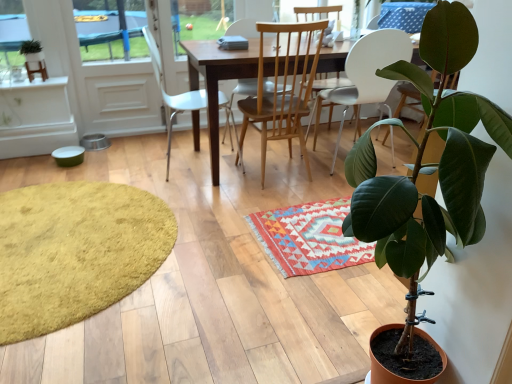
Where is `free spot in front of white plastic chair at center, acting as the 3th chair starting from the right`? free spot in front of white plastic chair at center, acting as the 3th chair starting from the right is located at coordinates (204, 187).